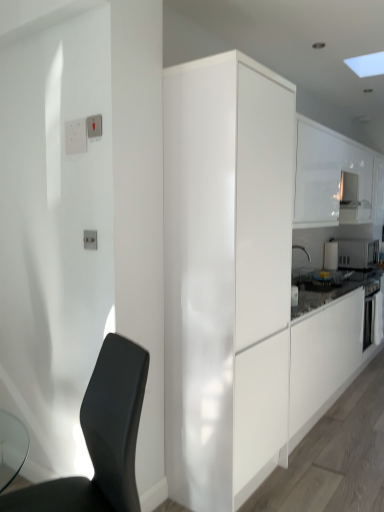
Describe the element at coordinates (100, 439) in the screenshot. I see `matte black chair at lower left` at that location.

The width and height of the screenshot is (384, 512). I want to click on black matte oven at right, so click(373, 319).

You are a GUI agent. You are given a task and a screenshot of the screen. Output one action in this format:
    pyautogui.click(x=<x>, y=<y>)
    Task: Click on the white glossy microwave at upper right, acting as the first appliance starting from the left
    This screenshot has height=512, width=384.
    Given the screenshot: What is the action you would take?
    pyautogui.click(x=330, y=256)

What do you see at coordinates (356, 253) in the screenshot? The width and height of the screenshot is (384, 512). I see `white glossy microwave at upper right, arranged as the 1th appliance when viewed from the right` at bounding box center [356, 253].

How much space does glossy white cabinet at center, which ranks as the 2th cabinetry in back-to-front order, occupy vertically?

7.08 feet.

How much space does white glossy cabinet at upper right, placed as the second cabinetry when sorted from front to back, occupy horizontally?

It is 15.08 inches.

Describe the element at coordinates (94, 126) in the screenshot. This screenshot has height=512, width=384. I see `white plastic light switch at upper left, the first light switch positioned from the right` at that location.

The width and height of the screenshot is (384, 512). Identify the location of matte black chair at lower left. (100, 439).

Is point (86, 230) in front of point (67, 506)?

No, (86, 230) is behind (67, 506).

Which of these two, white glossy electrical outlet at upper left or matte black chair at lower left, is smaller?

Smaller between the two is white glossy electrical outlet at upper left.

Can you tell me how much white plastic light switch at upper left, which ranks as the second light switch in back-to-front order, and glossy white cabinet at center, placed as the first cabinetry when sorted from left to right, differ in facing direction?

They differ by 90 degrees in their facing directions.

From the image's perspective, is white plastic light switch at upper left, the first light switch positioned from the right, located above or below glossy white cabinet at center, placed as the first cabinetry when sorted from left to right?

white plastic light switch at upper left, the first light switch positioned from the right, is above glossy white cabinet at center, placed as the first cabinetry when sorted from left to right.

Is white plastic light switch at upper left, the 2th light switch from the left, aimed at glossy white cabinet at center, which ranks as the 2th cabinetry in back-to-front order?

No.

Considering the relative sizes of white glossy microwave at upper right, arranged as the second appliance when viewed from the right, and white glossy cabinet at upper right, which is the first cabinetry from back to front, in the image provided, is white glossy microwave at upper right, arranged as the second appliance when viewed from the right, wider than white glossy cabinet at upper right, which is the first cabinetry from back to front,?

In fact, white glossy microwave at upper right, arranged as the second appliance when viewed from the right, might be narrower than white glossy cabinet at upper right, which is the first cabinetry from back to front.

From the image's perspective, is white glossy microwave at upper right, arranged as the second appliance when viewed from the right, below white glossy cabinet at upper right, marked as the 2th cabinetry in a left-to-right arrangement?

Correct, white glossy microwave at upper right, arranged as the second appliance when viewed from the right, appears lower than white glossy cabinet at upper right, marked as the 2th cabinetry in a left-to-right arrangement, in the image.

Starting from the white glossy cabinet at upper right, placed as the second cabinetry when sorted from front to back, which appliance is the 2nd one behind? Please provide its 2D coordinates.

[(330, 256)]

From the picture: Does white glossy microwave at upper right, arranged as the second appliance when viewed from the right, touch white glossy cabinet at upper right, which is the first cabinetry from back to front?

white glossy microwave at upper right, arranged as the second appliance when viewed from the right, is not next to white glossy cabinet at upper right, which is the first cabinetry from back to front, and they're not touching.

Is white plastic light switch at upper left, the 1th light switch viewed from the left, turned away from white glossy cabinet at upper right, placed as the second cabinetry when sorted from front to back?

That's right, white plastic light switch at upper left, the 1th light switch viewed from the left, is facing away from white glossy cabinet at upper right, placed as the second cabinetry when sorted from front to back.

Based on the photo, which of these two, white plastic light switch at upper left, the 1th light switch in the back-to-front sequence, or white glossy cabinet at upper right, which is the first cabinetry from back to front, stands shorter?

With less height is white plastic light switch at upper left, the 1th light switch in the back-to-front sequence.

Which of these two, white plastic light switch at upper left, the 2th light switch viewed from the right, or white glossy cabinet at upper right, which is the first cabinetry from back to front, is wider?

white glossy cabinet at upper right, which is the first cabinetry from back to front, is wider.

Is point (66, 145) closer or farther from the camera than point (336, 136)?

Point (66, 145) appears to be closer to the viewer than point (336, 136).

Which point is more forward, (x=364, y=255) or (x=131, y=511)?

The point (x=131, y=511) is closer to the camera.

What's the angular difference between white glossy microwave at upper right, the second appliance when ordered from left to right, and matte black chair at lower left's facing directions?

They differ by 109 degrees in their facing directions.

Can you confirm if white glossy microwave at upper right, the second appliance when ordered from left to right, is bigger than matte black chair at lower left?

Actually, white glossy microwave at upper right, the second appliance when ordered from left to right, might be smaller than matte black chair at lower left.

Is matte black chair at lower left surrounded by white glossy microwave at upper right, arranged as the 1th appliance when viewed from the right?

No, matte black chair at lower left is not inside white glossy microwave at upper right, arranged as the 1th appliance when viewed from the right.

Is white glossy cabinet at upper right, which is the first cabinetry from back to front, not near matte black chair at lower left?

Yes, white glossy cabinet at upper right, which is the first cabinetry from back to front, and matte black chair at lower left are located far from each other.

How far apart are white glossy cabinet at upper right, which ranks as the 1th cabinetry in right-to-left order, and matte black chair at lower left?

white glossy cabinet at upper right, which ranks as the 1th cabinetry in right-to-left order, and matte black chair at lower left are 7.77 feet apart from each other.

From the picture: Based on their sizes in the image, would you say white glossy cabinet at upper right, placed as the second cabinetry when sorted from front to back, is bigger or smaller than matte black chair at lower left?

In the image, white glossy cabinet at upper right, placed as the second cabinetry when sorted from front to back, appears to be larger than matte black chair at lower left.

Locate an element on the screen. chair that appears below the white glossy cabinet at upper right, which ranks as the 1th cabinetry in right-to-left order (from the image's perspective) is located at coordinates (100, 439).

Which of these two, white glossy electrical outlet at upper left or white plastic light switch at upper left, which appears as the first light switch when viewed from the front, stands taller?

white plastic light switch at upper left, which appears as the first light switch when viewed from the front.

Are white glossy electrical outlet at upper left and white plastic light switch at upper left, the 2th light switch from the left, beside each other?

white glossy electrical outlet at upper left is not next to white plastic light switch at upper left, the 2th light switch from the left, and they're not touching.

Is white glossy electrical outlet at upper left facing away from white plastic light switch at upper left, the 2th light switch from the left?

No, white glossy electrical outlet at upper left's orientation is not away from white plastic light switch at upper left, the 2th light switch from the left.

Which is behind, point (95, 249) or point (96, 126)?

Point (95, 249)

At what (x,y) coordinates should I click in order to perform the action: click on electric outlet that is on the left side of matte black chair at lower left. Please return your answer as a coordinate pair (x, y). The width and height of the screenshot is (384, 512). Looking at the image, I should click on (90, 239).

There is a glossy white cabinet at center, marked as the 2th cabinetry in a right-to-left arrangement. Identify the location of the 2nd light switch above it (from the image's perspective). The image size is (384, 512). (94, 126).

From the image, which object appears to be nearer to white glossy cabinet at upper right, placed as the second cabinetry when sorted from front to back, white glossy microwave at upper right, arranged as the second appliance when viewed from the right, or white glossy electrical outlet at upper left?

Based on the image, white glossy microwave at upper right, arranged as the second appliance when viewed from the right, appears to be nearer to white glossy cabinet at upper right, placed as the second cabinetry when sorted from front to back.

When comparing their distances from black matte oven at right, does white glossy microwave at upper right, arranged as the second appliance when viewed from the right, or white plastic light switch at upper left, the 1th light switch in the back-to-front sequence, seem closer?

white glossy microwave at upper right, arranged as the second appliance when viewed from the right, lies closer to black matte oven at right than the other object.

Consider the image. When comparing their distances from matte black chair at lower left, does white glossy microwave at upper right, acting as the first appliance starting from the left, or white glossy microwave at upper right, the second appliance when ordered from left to right, seem closer?

Among the two, white glossy microwave at upper right, acting as the first appliance starting from the left, is located nearer to matte black chair at lower left.

In the scene shown: From the image, which object appears to be farther from white plastic light switch at upper left, which appears as the first light switch when viewed from the front, white glossy electrical outlet at upper left or black matte oven at right?

black matte oven at right is positioned further to the anchor white plastic light switch at upper left, which appears as the first light switch when viewed from the front.

When comparing their distances from white plastic light switch at upper left, the 2th light switch viewed from the front, does white glossy microwave at upper right, arranged as the 1th appliance when viewed from the right, or white glossy cabinet at upper right, marked as the 2th cabinetry in a left-to-right arrangement, seem closer?

Among the two, white glossy cabinet at upper right, marked as the 2th cabinetry in a left-to-right arrangement, is located nearer to white plastic light switch at upper left, the 2th light switch viewed from the front.

Looking at the image, which one is located further to matte black chair at lower left, white glossy cabinet at upper right, which is the first cabinetry from back to front, or white plastic light switch at upper left, the 1th light switch viewed from the left?

white glossy cabinet at upper right, which is the first cabinetry from back to front.

From the image, which object appears to be farther from white glossy electrical outlet at upper left, black matte oven at right or white glossy microwave at upper right, arranged as the second appliance when viewed from the right?

white glossy microwave at upper right, arranged as the second appliance when viewed from the right.

Based on their spatial positions, is black matte oven at right or white plastic light switch at upper left, which ranks as the second light switch in back-to-front order, further from white glossy electrical outlet at upper left?

black matte oven at right is positioned further to the anchor white glossy electrical outlet at upper left.

Locate an element on the screen. Image resolution: width=384 pixels, height=512 pixels. electric outlet between white plastic light switch at upper left, the 2th light switch from the left, and glossy white cabinet at center, placed as the first cabinetry when sorted from left to right, vertically is located at coordinates (90, 239).

Identify the location of electric outlet positioned between matte black chair at lower left and white glossy microwave at upper right, acting as the first appliance starting from the left, from near to far. The image size is (384, 512). (90, 239).

Image resolution: width=384 pixels, height=512 pixels. What are the coordinates of `oven positioned between white glossy cabinet at upper right, placed as the second cabinetry when sorted from front to back, and white glossy microwave at upper right, arranged as the 1th appliance when viewed from the right, from near to far` in the screenshot? It's located at (373, 319).

The height and width of the screenshot is (512, 384). Find the location of `cabinetry positioned between white glossy electrical outlet at upper left and white glossy microwave at upper right, acting as the first appliance starting from the left, from near to far`. cabinetry positioned between white glossy electrical outlet at upper left and white glossy microwave at upper right, acting as the first appliance starting from the left, from near to far is located at coordinates (333, 176).